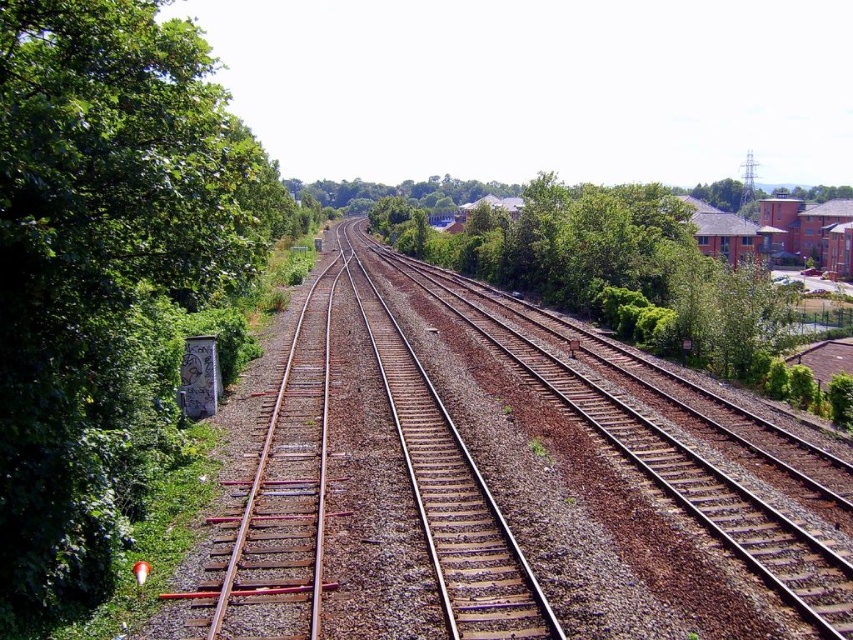
Question: Does brown gravel track at center have a lesser width compared to green leafy tree at center?

Choices:
 (A) yes
 (B) no

Answer: (A)

Question: Estimate the real-world distances between objects in this image. Which object is farther from the green leafy tree at left?

Choices:
 (A) green leafy tree at center
 (B) brown gravel track at center

Answer: (A)

Question: Is brown gravel track at center positioned in front of green leafy tree at left?

Choices:
 (A) no
 (B) yes

Answer: (A)

Question: Which is farther from the green leafy tree at left?

Choices:
 (A) green leafy tree at center
 (B) brown gravel track at center

Answer: (A)

Question: Is brown gravel track at center to the left of green leafy tree at left from the viewer's perspective?

Choices:
 (A) no
 (B) yes

Answer: (A)

Question: Estimate the real-world distances between objects in this image. Which object is farther from the green leafy tree at left?

Choices:
 (A) brown gravel track at center
 (B) green leafy tree at center

Answer: (B)